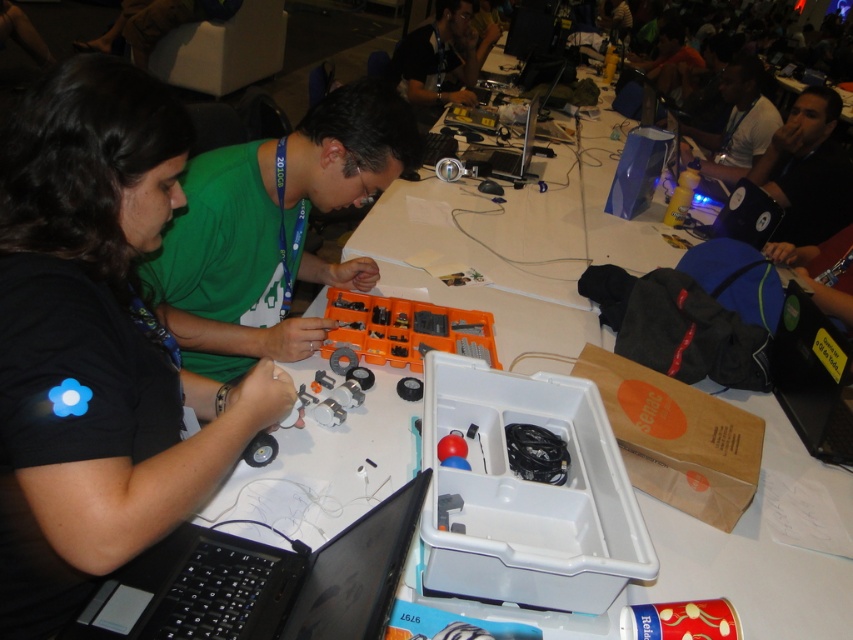
Looking at this image, where is the black matte shirt at left located in the image?

The black matte shirt at left is located at point (97,344).

You are a photographer at the event and need to capture a clear shot of both the black matte shirt at left and the matte black shirt at upper center. Based on their positions, which shirt is positioned lower on the image?

The black matte shirt at left is located below the matte black shirt at upper center, so the black matte shirt at left is positioned lower on the image.

From the picture: You are a photographer at the event and need to capture a clear shot of both the matte black shirt at upper center and the matte black laptop at upper right. Considering their heights, which one might require you to adjust your camera angle more to include both in the frame?

The matte black shirt at upper center has a greater height compared to the matte black laptop at upper right, so you might need to adjust your camera angle to account for its taller stature to ensure both are visible in the frame.